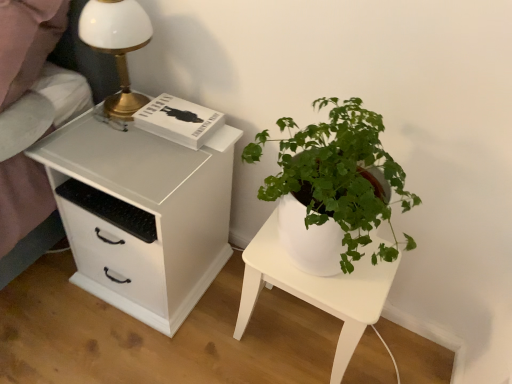
Locate an element on the screen. free spot in front of white glossy table lamp at upper left is located at coordinates pos(106,142).